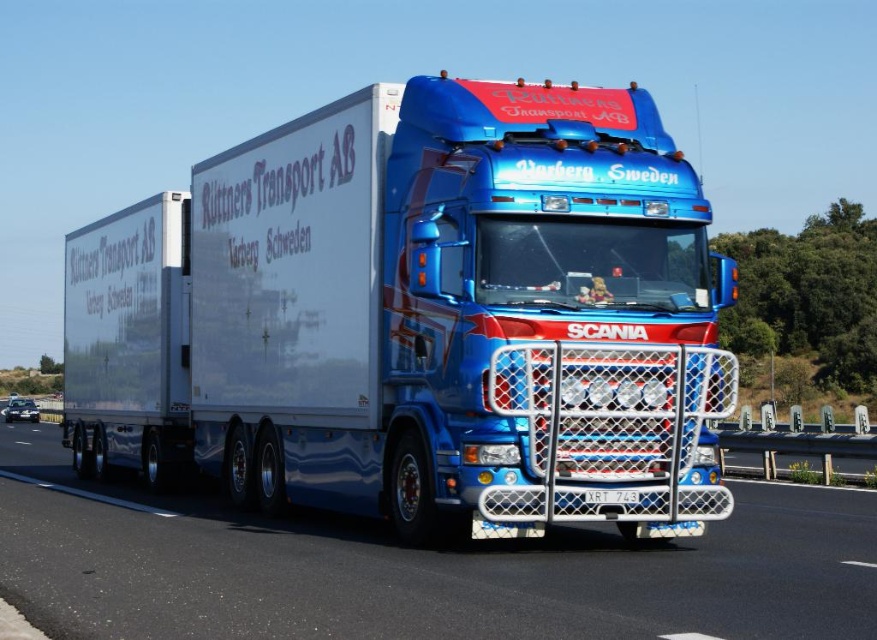
Question: Which of the following is the closest to the observer?

Choices:
 (A) (521, 202)
 (B) (745, 493)

Answer: (A)

Question: Which point is closer to the camera?

Choices:
 (A) (624, 493)
 (B) (704, 534)

Answer: (A)

Question: Which point is farther to the camera?

Choices:
 (A) (498, 557)
 (B) (596, 500)

Answer: (A)

Question: Does shiny metallic trailer truck at center appear on the left side of white plastic license plate at center?

Choices:
 (A) yes
 (B) no

Answer: (A)

Question: Is shiny metallic trailer truck at center bigger than white plastic license plate at center?

Choices:
 (A) no
 (B) yes

Answer: (B)

Question: Considering the relative positions of metallic asphalt road at center and white plastic license plate at center in the image provided, where is metallic asphalt road at center located with respect to white plastic license plate at center?

Choices:
 (A) right
 (B) left

Answer: (B)